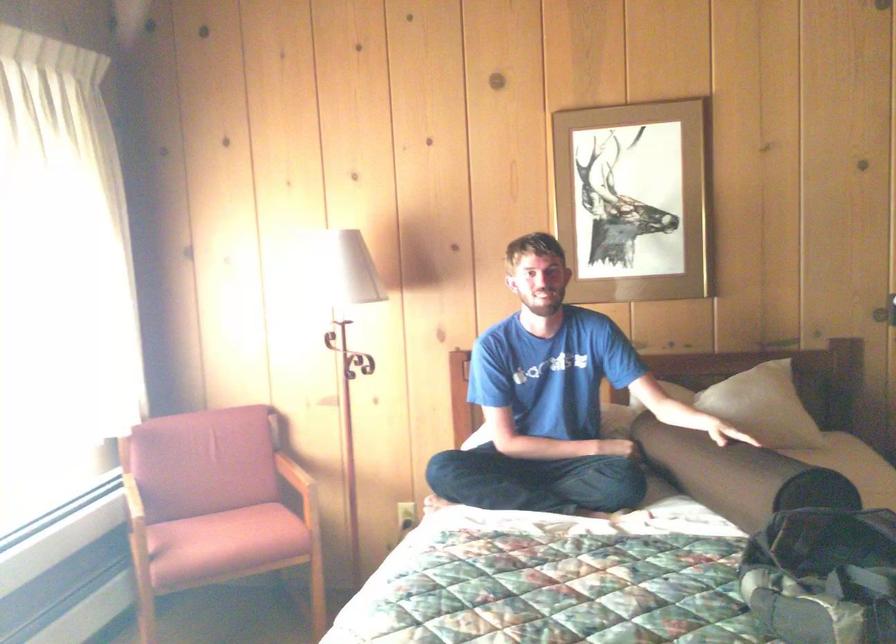
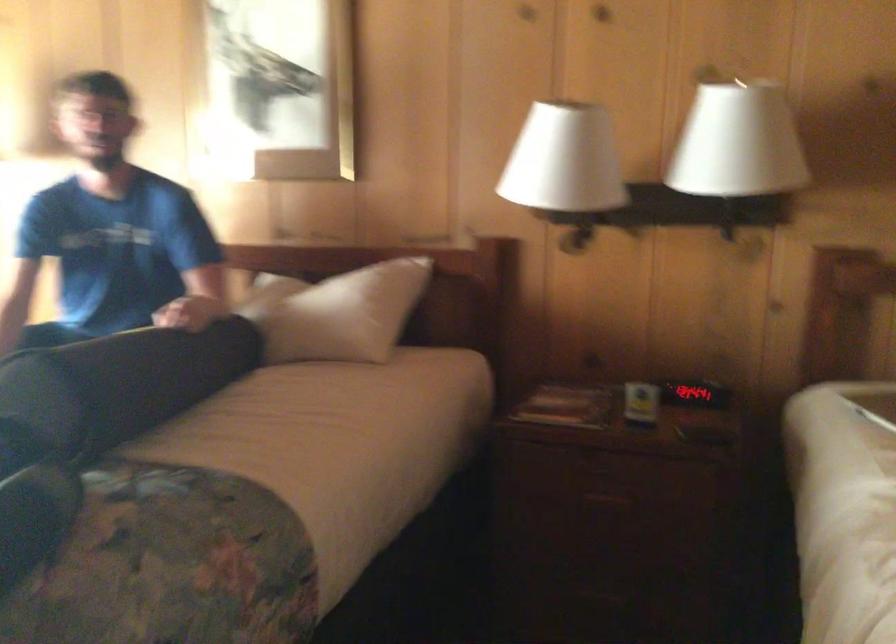
Find the pixel in the second image that matches point 803,402 in the first image.

(340, 313)